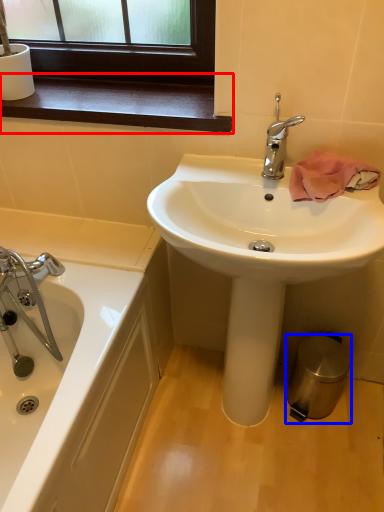
Question: Among these objects, which one is nearest to the camera, window sill (highlighted by a red box) or trash bin/can (highlighted by a blue box)?

Choices:
 (A) window sill
 (B) trash bin/can

Answer: (A)